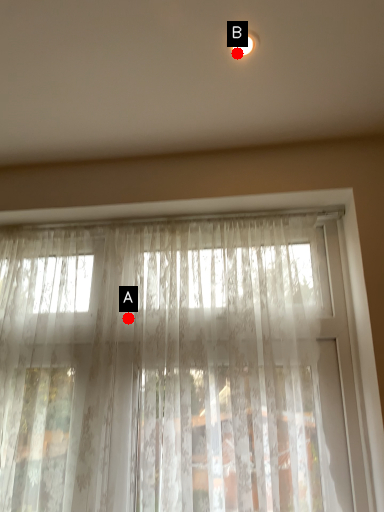
Question: Two points are circled on the image, labeled by A and B beside each circle. Which point is farther to the camera?

Choices:
 (A) A is further
 (B) B is further

Answer: (A)